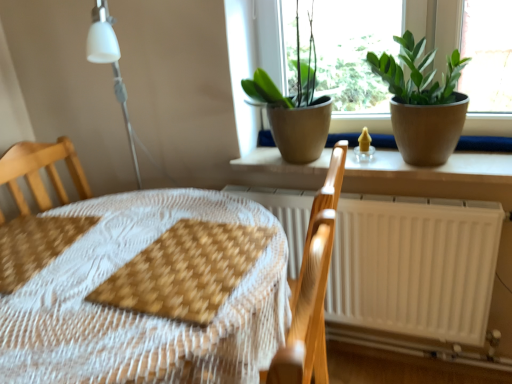
Question: Does point (130, 269) appear closer or farther from the camera than point (99, 228)?

Choices:
 (A) farther
 (B) closer

Answer: (B)

Question: Is brown woven placemat at center, which is the first sheet in right-to-left order, inside or outside of wooden placemat at center?

Choices:
 (A) outside
 (B) inside

Answer: (B)

Question: Which object is positioned farthest from the green matte plant at upper center, placed as the second houseplant when sorted from right to left?

Choices:
 (A) light wood armchair at center
 (B) green matte plant at upper right, positioned as the first houseplant in right-to-left order
 (C) white matte radiator at lower right
 (D) matte brown window sill at center
 (E) brown woven placemat at center, which is the first sheet in right-to-left order

Answer: (E)

Question: Which object is positioned closest to the matte yellow candle holder at center?

Choices:
 (A) brown woven placemat at center, which is the first sheet in right-to-left order
 (B) green matte plant at upper right, positioned as the first houseplant in right-to-left order
 (C) light wood armchair at center
 (D) white matte radiator at lower right
 (E) brown woven placemat at lower left, arranged as the 2th sheet when viewed from the right

Answer: (B)